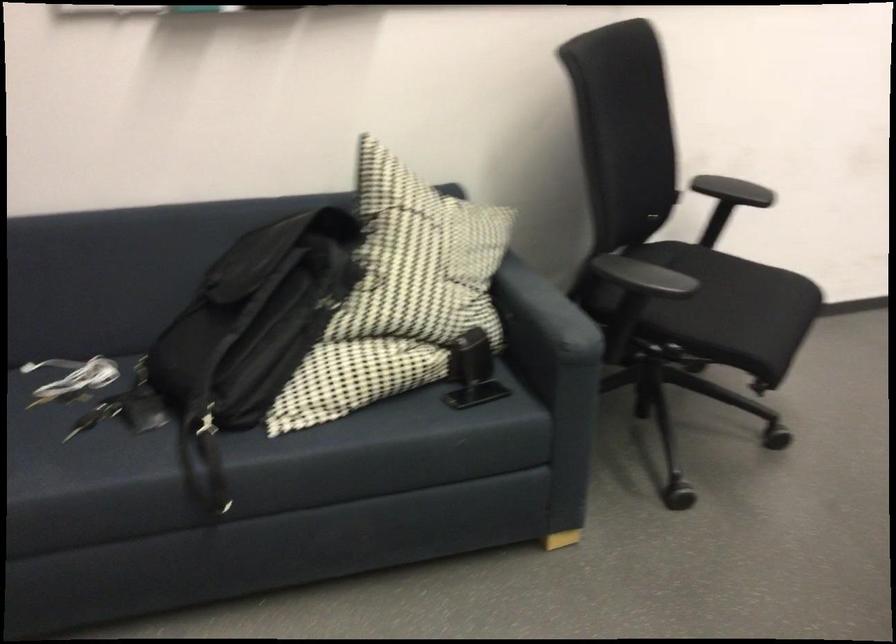
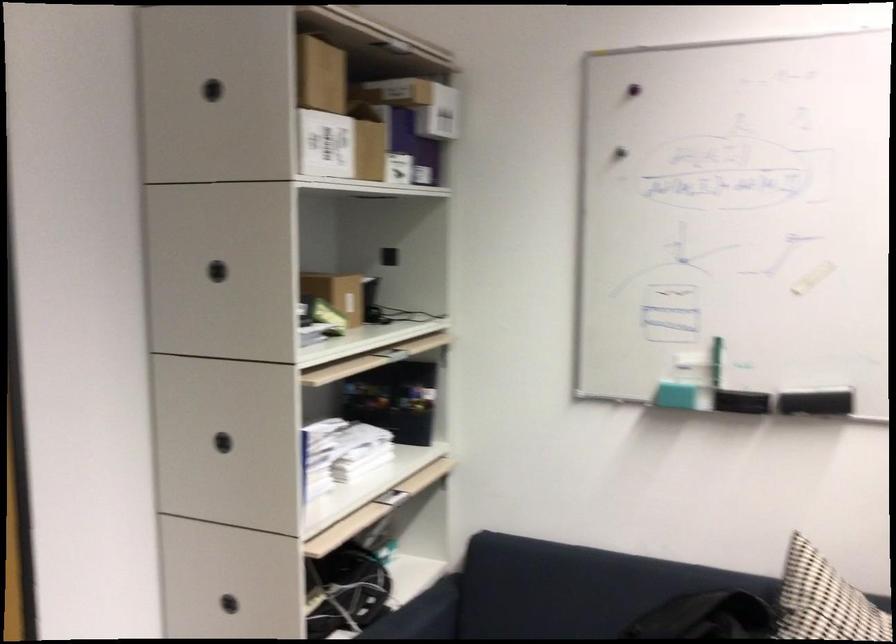
The point at (91,313) is marked in the first image. Where is the corresponding point in the second image?

(533, 625)